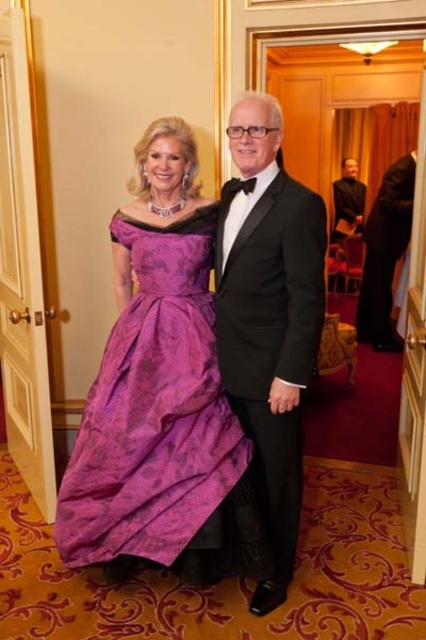
Does black satin tuxedo at center appear on the left side of black satin suit at center?

Yes, black satin tuxedo at center is to the left of black satin suit at center.

The image size is (426, 640). Find the location of `black satin tuxedo at center`. black satin tuxedo at center is located at coordinates (268, 317).

At what (x,y) coordinates should I click in order to perform the action: click on black satin tuxedo at center. Please return your answer as a coordinate pair (x, y). Looking at the image, I should click on (268, 317).

Which of these two, black satin tuxedo at center or black satin suit at right, stands shorter?

black satin suit at right is shorter.

Image resolution: width=426 pixels, height=640 pixels. Describe the element at coordinates (268, 317) in the screenshot. I see `black satin tuxedo at center` at that location.

I want to click on black satin tuxedo at center, so click(x=268, y=317).

Measure the distance between black satin suit at right and black satin suit at center.

A distance of 4.49 feet exists between black satin suit at right and black satin suit at center.

Is black satin suit at right to the right of black satin suit at center from the viewer's perspective?

Yes, black satin suit at right is to the right of black satin suit at center.

Does point (405, 182) come closer to viewer compared to point (344, 209)?

Yes, point (405, 182) is in front of point (344, 209).

This screenshot has width=426, height=640. What are the coordinates of `black satin suit at right` in the screenshot? It's located at (385, 252).